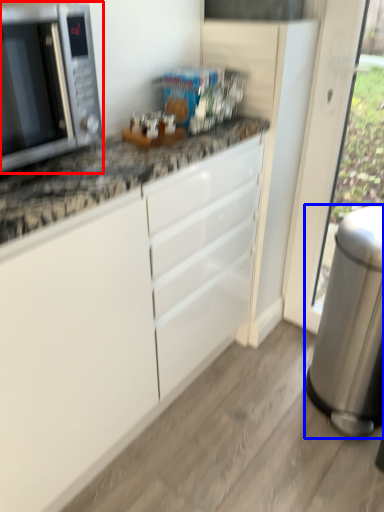
Question: Among these objects, which one is nearest to the camera, microwave oven (highlighted by a red box) or appliance (highlighted by a blue box)?

Choices:
 (A) microwave oven
 (B) appliance

Answer: (A)